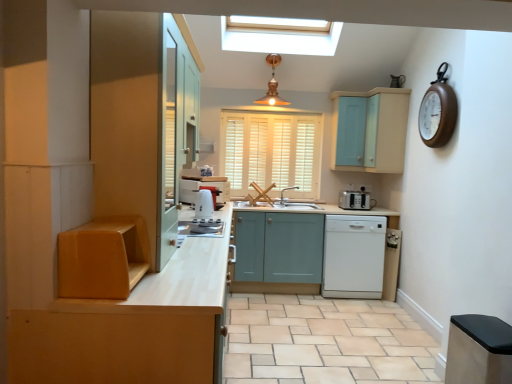
This screenshot has height=384, width=512. Find the location of `vacant area on top of beige tile at lower right (from a real-world perspective)`. vacant area on top of beige tile at lower right (from a real-world perspective) is located at coordinates (316, 327).